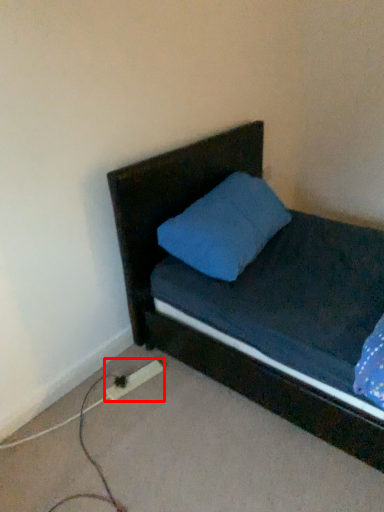
Question: Considering the relative positions of extension cord (annotated by the red box) and headboard in the image provided, where is extension cord (annotated by the red box) located with respect to the staircase?

Choices:
 (A) right
 (B) left

Answer: (B)